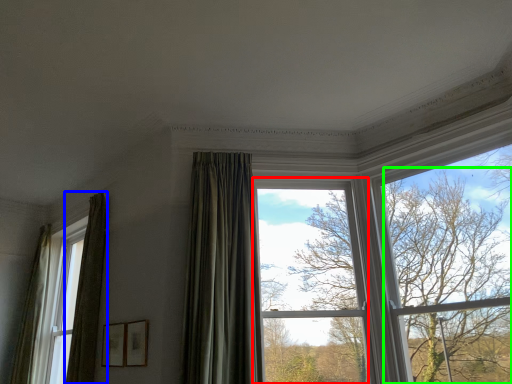
Question: Estimate the real-world distances between objects in this image. Which object is farther from window (highlighted by a red box), curtain (highlighted by a blue box) or tree (highlighted by a green box)?

Choices:
 (A) curtain
 (B) tree

Answer: (A)